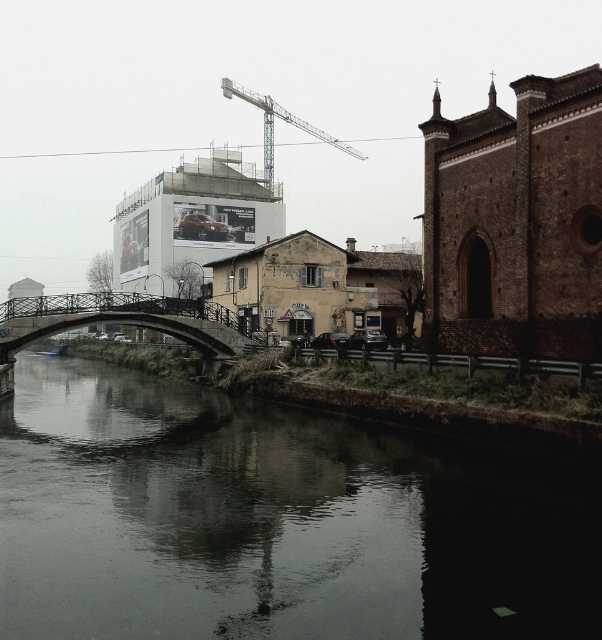
Based on the photo, which is more to the right, metallic bridge at center or metallic gray crane at upper center?

metallic gray crane at upper center is more to the right.

Is metallic bridge at center thinner than metallic gray crane at upper center?

Indeed, metallic bridge at center has a lesser width compared to metallic gray crane at upper center.

Between point (211, 349) and point (282, 116), which one is positioned behind?

Positioned behind is point (282, 116).

Where is `metallic bridge at center`? The width and height of the screenshot is (602, 640). metallic bridge at center is located at coordinates (125, 321).

Which is in front, point (252, 515) or point (190, 300)?

Point (252, 515)

Does point (193, 442) come farther from viewer compared to point (261, 337)?

No, it is in front of (261, 337).

The height and width of the screenshot is (640, 602). I want to click on dark reflective water at center, so click(273, 520).

Does dark reflective water at center have a smaller size compared to metallic gray crane at upper center?

Indeed, dark reflective water at center has a smaller size compared to metallic gray crane at upper center.

Can you confirm if dark reflective water at center is thinner than metallic gray crane at upper center?

Correct, dark reflective water at center's width is less than metallic gray crane at upper center's.

Between point (270, 509) and point (323, 140), which one is positioned in front?

Point (270, 509) is in front.

This screenshot has height=640, width=602. What are the coordinates of `dark reflective water at center` in the screenshot? It's located at (273, 520).